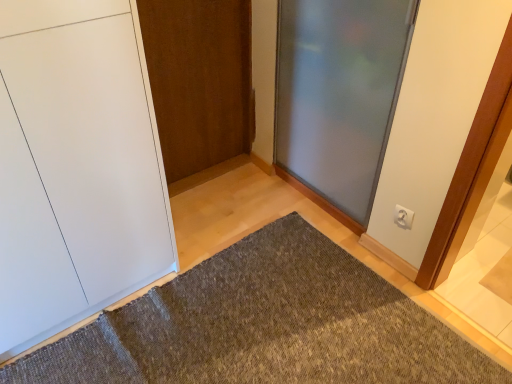
Image resolution: width=512 pixels, height=384 pixels. What are the coordinates of `vacant region above textured gray doormat at center (from a real-world perspective)` in the screenshot? It's located at (217, 329).